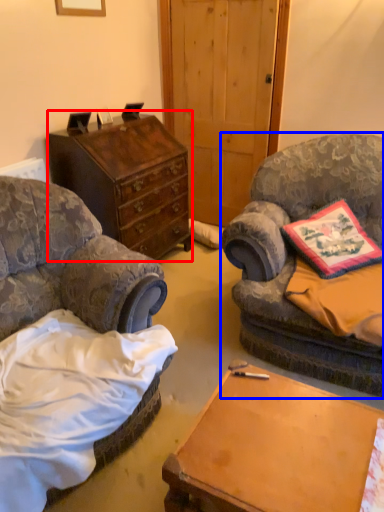
Question: Which object is further to the camera taking this photo, chest of drawers (highlighted by a red box) or chair (highlighted by a blue box)?

Choices:
 (A) chest of drawers
 (B) chair

Answer: (A)